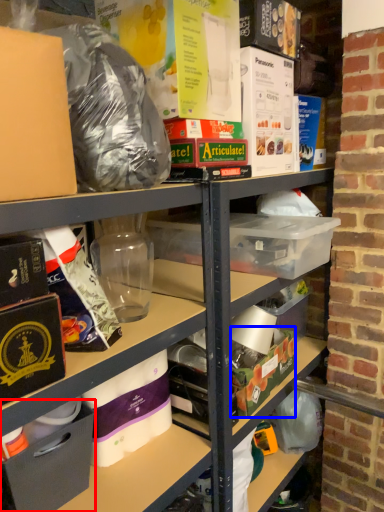
Question: Which object is closer to the camera taking this photo, box (highlighted by a red box) or box (highlighted by a blue box)?

Choices:
 (A) box
 (B) box

Answer: (A)